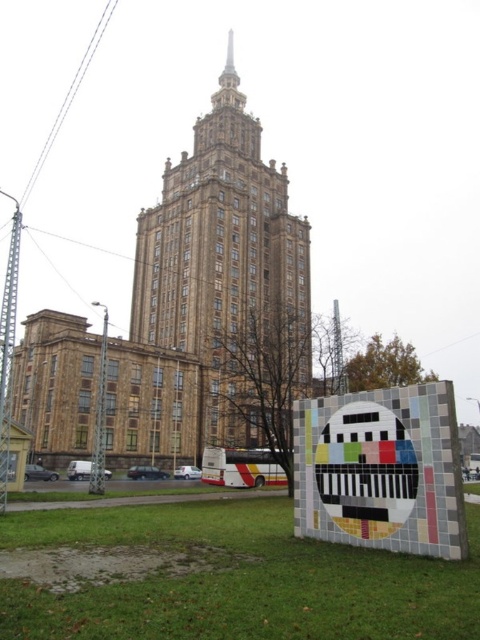
Question: Does brown stone tower at center appear on the left side of multicolored mosaic sign at lower right?

Choices:
 (A) no
 (B) yes

Answer: (B)

Question: Which point is closer to the camera?

Choices:
 (A) brown stone tower at center
 (B) multicolored mosaic sign at lower right

Answer: (B)

Question: Where is brown stone tower at center located in relation to multicolored mosaic sign at lower right in the image?

Choices:
 (A) left
 (B) right

Answer: (A)

Question: Can you confirm if brown stone tower at center is wider than multicolored mosaic sign at lower right?

Choices:
 (A) no
 (B) yes

Answer: (B)